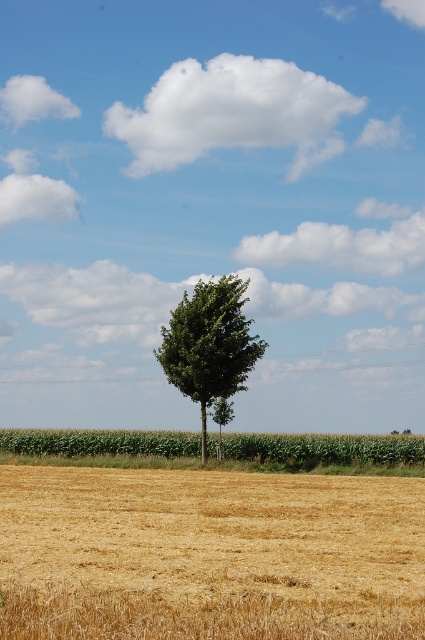
You are a farmer planning to plant a new crop in the field. You notice the golden dry wheat at center and the green leafy tree at center. Which of these two has a larger area coverage in the image?

The golden dry wheat at center has a larger area coverage than the green leafy tree at center according to the description.

You are a drone operator trying to capture aerial footage of the green matte corn field at center and the green leafy tree at center. Which object will appear closer to the camera in the footage?

The green matte corn field at center will appear closer to the camera in the footage because it is further to the viewer than the green leafy tree at center.

You are standing at the point marked by the coordinates point (209, 554). Looking around, you see golden dry wheat at center. What is the immediate terrain you are standing on?

The point (209, 554) marks golden dry wheat at center, so you are standing on golden dry wheat at center.